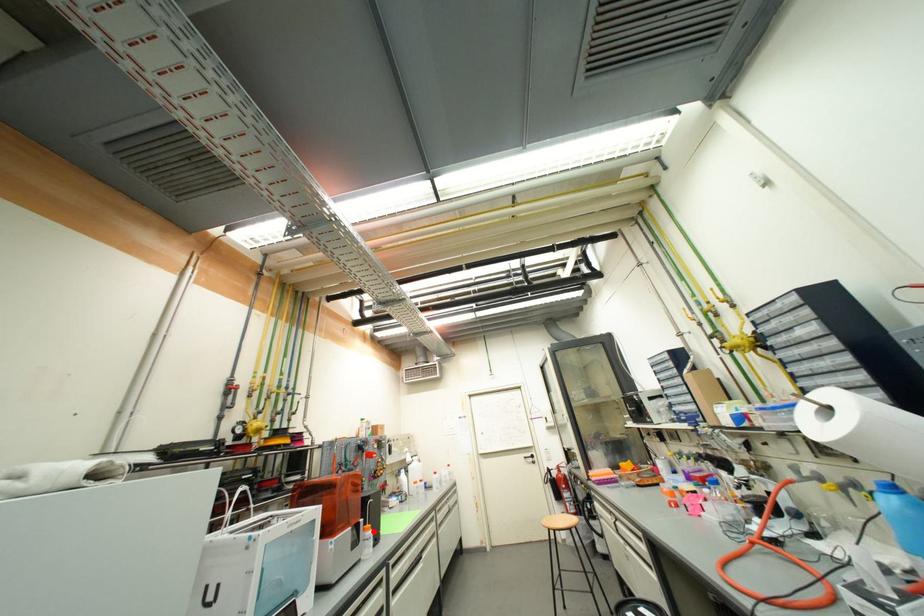
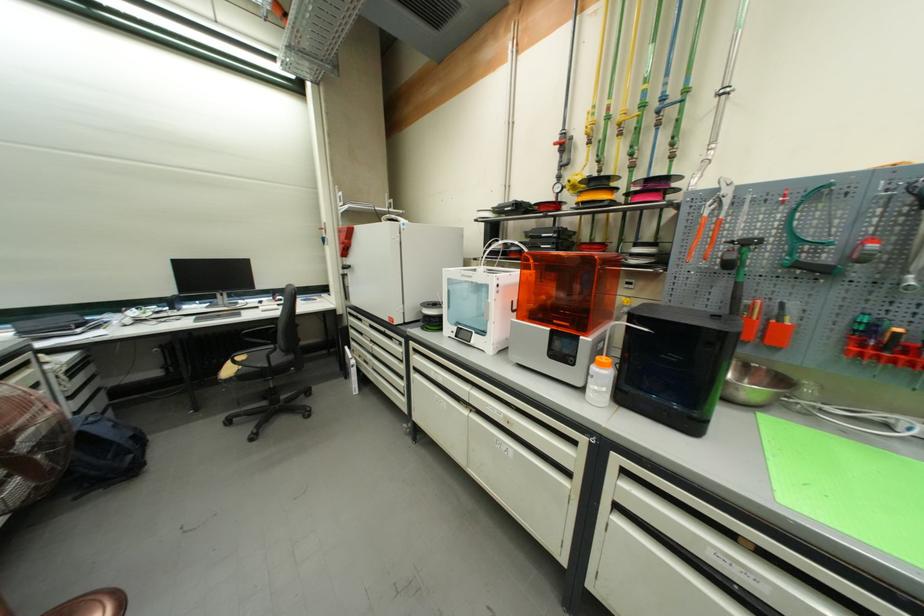
Locate, in the second image, the point that corresponds to the highlighted location in the first image.

(606, 367)